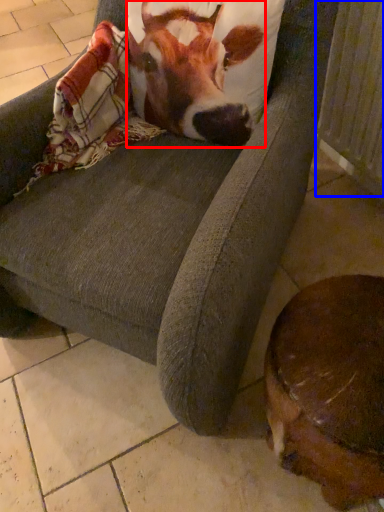
Question: Which point is closer to the camera, cattle (highlighted by a red box) or radiator (highlighted by a blue box)?

Choices:
 (A) cattle
 (B) radiator

Answer: (A)